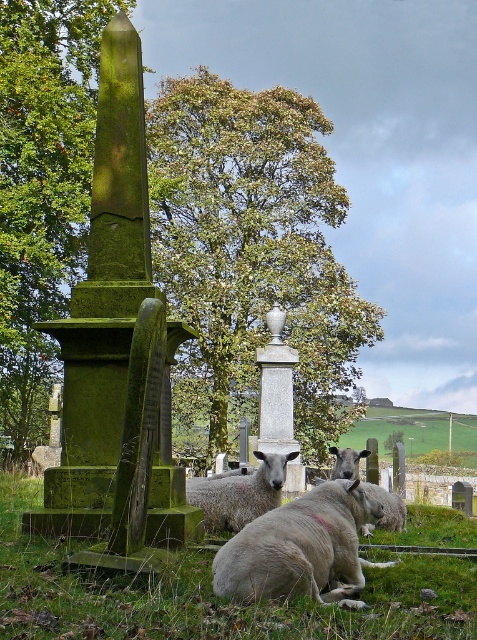
You are a photographer aiming to capture a clear shot of the gray woolen sheep at center without the green mossy stone obelisk at left blocking the view. Based on their positions, can you position yourself in a way to avoid the obelisk?

The green mossy stone obelisk at left is located above the gray woolen sheep at center, so if you position yourself lower or adjust your angle to look upwards, you can avoid the obelisk blocking the view of the gray woolen sheep at center.

You are a photographer standing in the cemetery and want to take a photo that includes both the sheep and the gravestones. You have two points marked on your viewfinder at coordinates point [292,545] and point [385,525]. Which point is closer to you, and should you focus on that point to ensure the sheep are in sharp focus?

Point [292,545] is closer to the viewer than point [385,525]. Therefore, you should focus on point [292,545] to ensure the sheep are in sharp focus.

You are a photographer trying to capture a wide shot of the cemetery scene. You want to include both the green leafy tree at center and the green grassy at center in your frame. Which object will occupy more space in your photo?

The green leafy tree at center is bigger than green grassy at center, so it will occupy more space in the photo.